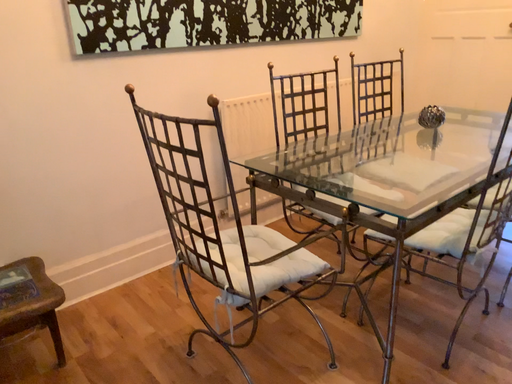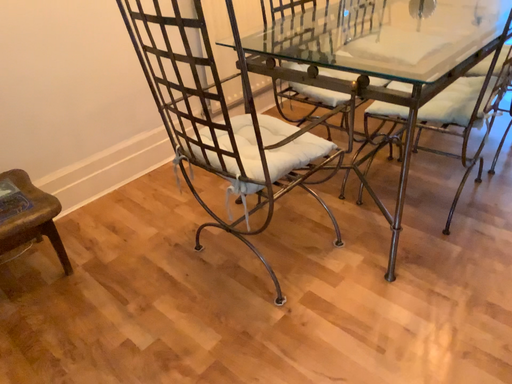
Question: How did the camera likely rotate when shooting the video?

Choices:
 (A) rotated upward
 (B) rotated downward

Answer: (B)